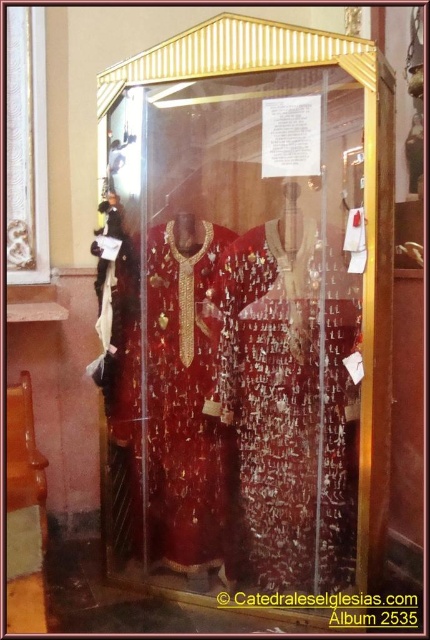
Question: Which object is closer to the camera taking this photo?

Choices:
 (A) transparent glass door at center
 (B) shiny gold fabric robe at center
 (C) black paper at center

Answer: (A)

Question: Which is nearer to the black paper at center?

Choices:
 (A) transparent glass door at center
 (B) shiny gold fabric robe at center

Answer: (B)

Question: Does shiny gold fabric robe at center have a greater width compared to black paper at center?

Choices:
 (A) yes
 (B) no

Answer: (B)

Question: Which point is closer to the camera taking this photo?

Choices:
 (A) (147, 547)
 (B) (236, 605)
 (C) (248, 243)

Answer: (C)

Question: Is shiny gold fabric robe at center further to camera compared to black paper at center?

Choices:
 (A) no
 (B) yes

Answer: (A)

Question: Does transparent glass door at center have a smaller size compared to black paper at center?

Choices:
 (A) yes
 (B) no

Answer: (B)